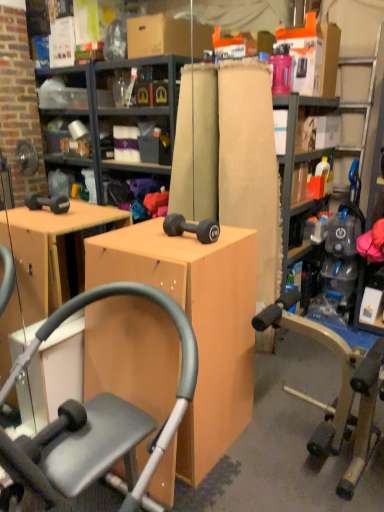
This screenshot has height=512, width=384. In order to click on empty space that is ontop of matte wood desk at center (from a real-world perspective) in this screenshot , I will do `click(155, 244)`.